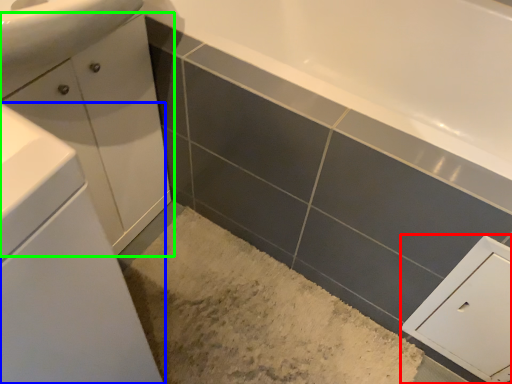
Question: Which object is positioned farthest from cabinetry (highlighted by a red box)? Select from bathroom cabinet (highlighted by a blue box) and bathroom cabinet (highlighted by a green box).

Choices:
 (A) bathroom cabinet
 (B) bathroom cabinet

Answer: (B)